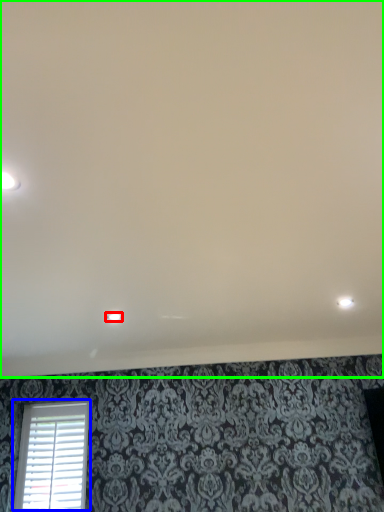
Question: Based on their relative distances, which object is nearer to dot (highlighted by a red box)? Choose from window (highlighted by a blue box) and backdrop (highlighted by a green box).

Choices:
 (A) window
 (B) backdrop

Answer: (B)